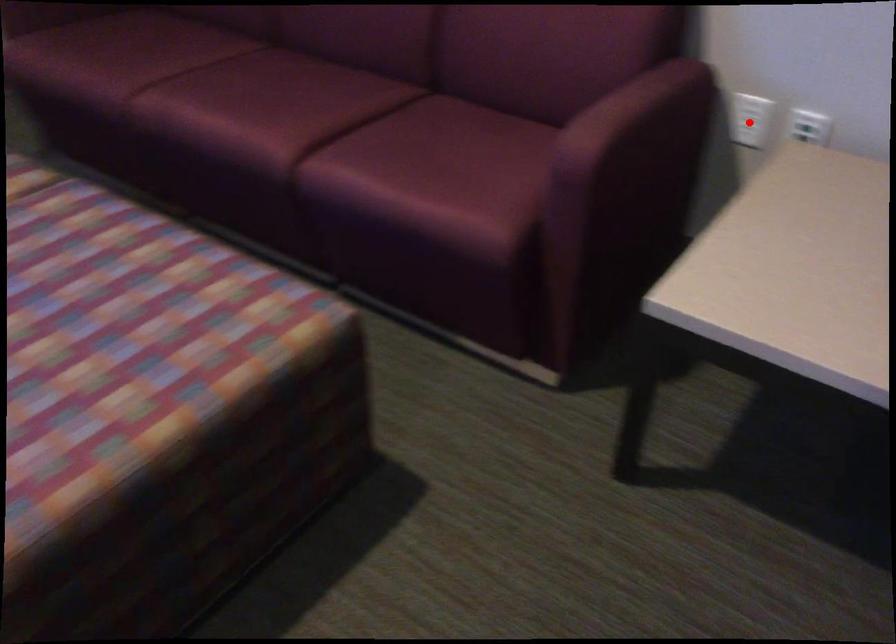
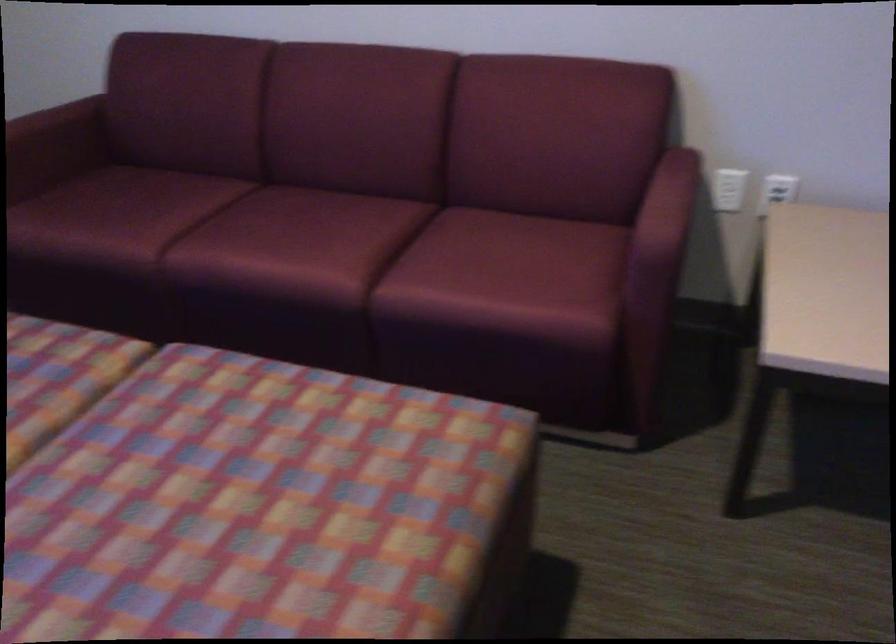
Question: I am providing you with two images of the same scene from different viewpoints. In image1, a red point is highlighted. Considering the same 3D point in image2, which of the following is correct?

Choices:
 (A) It is closer
 (B) It is farther

Answer: (B)